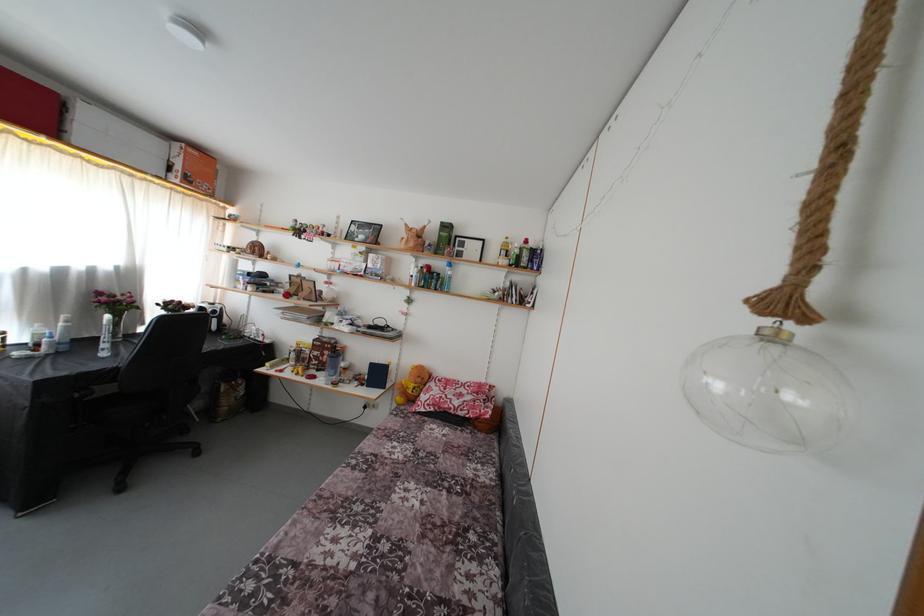
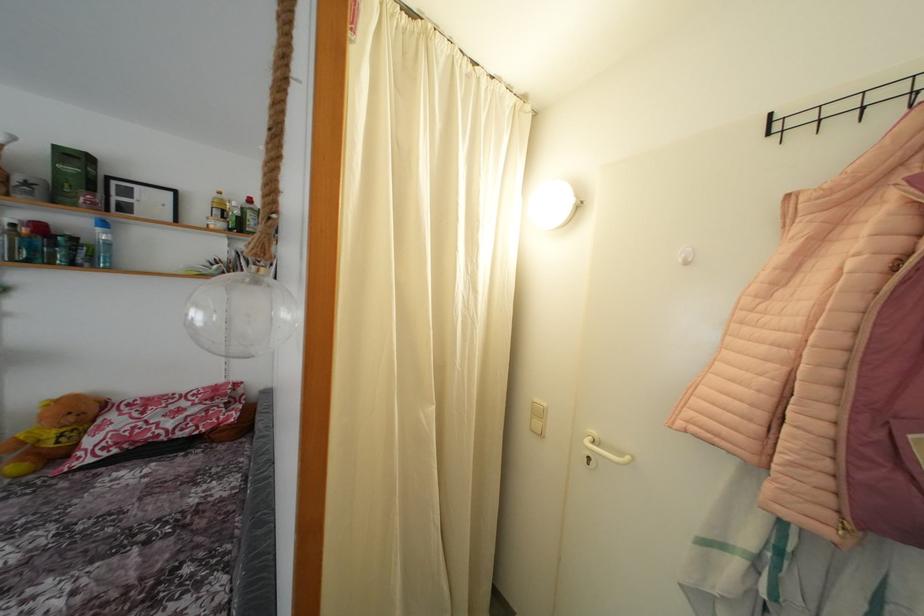
Where in the second image is the point corresponding to point (424, 386) from the first image?

(77, 424)